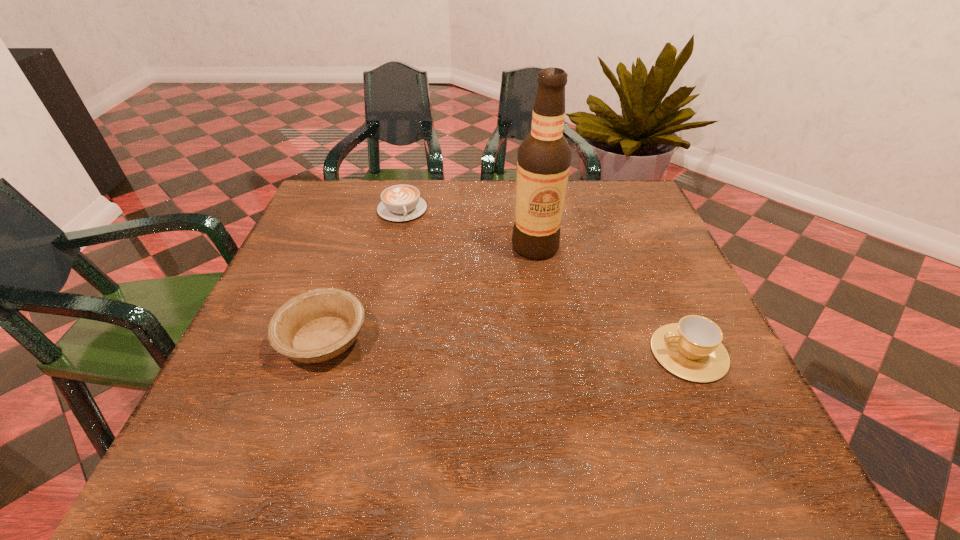
At what (x,y) coordinates should I click in order to perform the action: click on unoccupied area between the farthest object and the bowl. Please return your answer as a coordinate pair (x, y). Image resolution: width=960 pixels, height=540 pixels. Looking at the image, I should click on (363, 275).

The width and height of the screenshot is (960, 540). I want to click on free space that is in between the bowl and the tallest object, so click(x=429, y=293).

The width and height of the screenshot is (960, 540). What are the coordinates of `vacant space that is in between the tallest object and the rightmost object` in the screenshot? It's located at (612, 300).

Find the location of a particular element. Image resolution: width=960 pixels, height=540 pixels. free spot between the bowl and the rightmost object is located at coordinates (506, 346).

This screenshot has width=960, height=540. I want to click on free space between the farthest object and the bowl, so click(x=363, y=275).

At what (x,y) coordinates should I click in order to perform the action: click on free space between the rightmost object and the bowl. Please return your answer as a coordinate pair (x, y). This screenshot has width=960, height=540. Looking at the image, I should click on (506, 346).

Locate an element on the screen. The width and height of the screenshot is (960, 540). vacant area that lies between the bowl and the cup is located at coordinates coord(506,346).

The height and width of the screenshot is (540, 960). I want to click on unoccupied area between the third object from left to right and the farthest object, so click(468, 228).

In order to click on free space between the cappuccino and the third object from left to right in this screenshot , I will do `click(468, 228)`.

Find the location of a particular element. object that is the closest to the cappuccino is located at coordinates (543, 162).